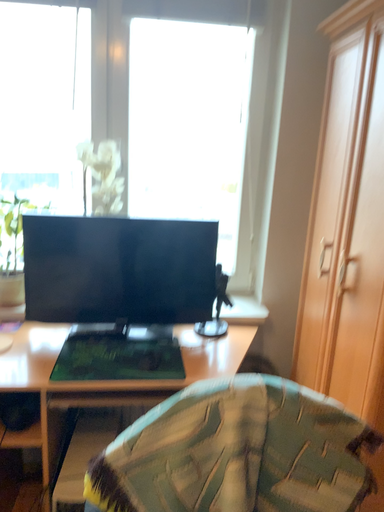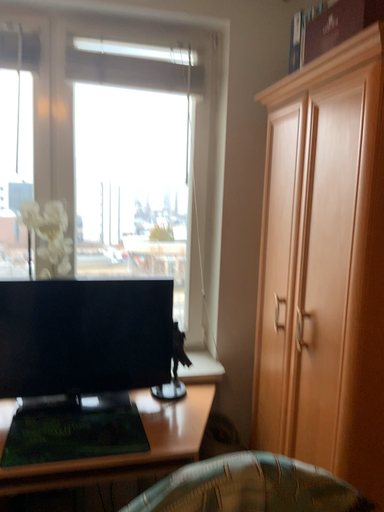
Question: Which way did the camera rotate in the video?

Choices:
 (A) rotated downward
 (B) rotated upward

Answer: (B)